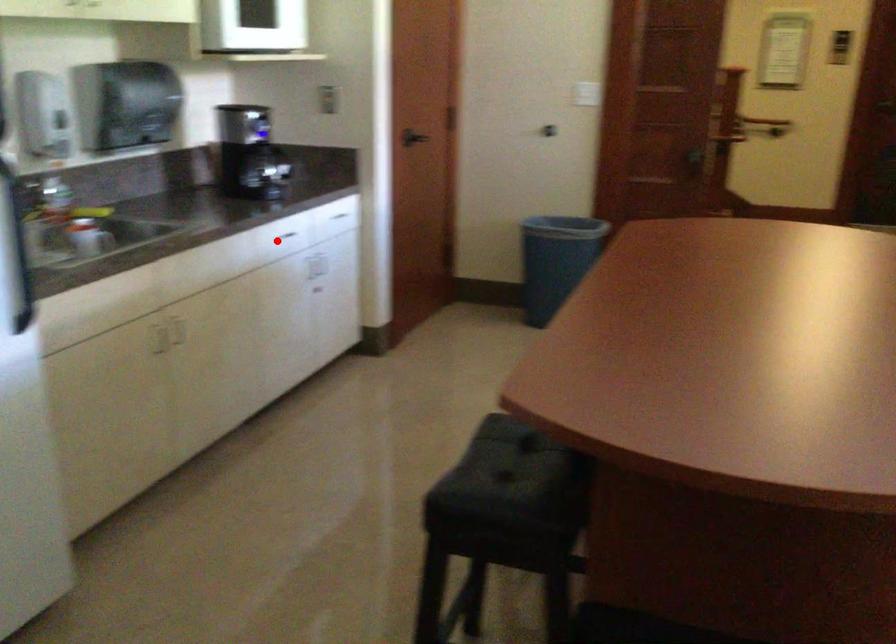
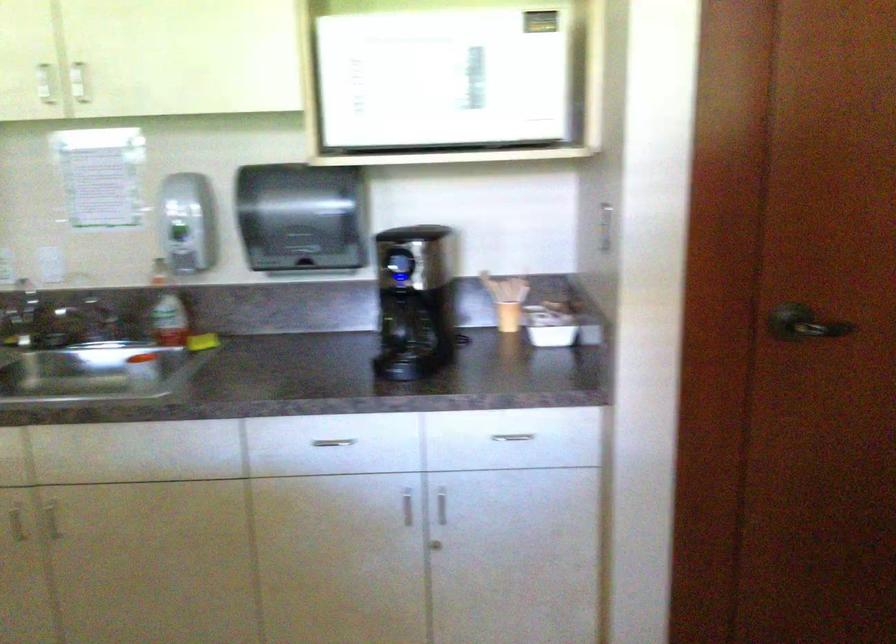
Question: I am providing you with two images of the same scene from different viewpoints. A red point is shown in image1. For the corresponding object point in image2, is it positioned nearer or farther from the camera?

Choices:
 (A) Nearer
 (B) Farther

Answer: (A)